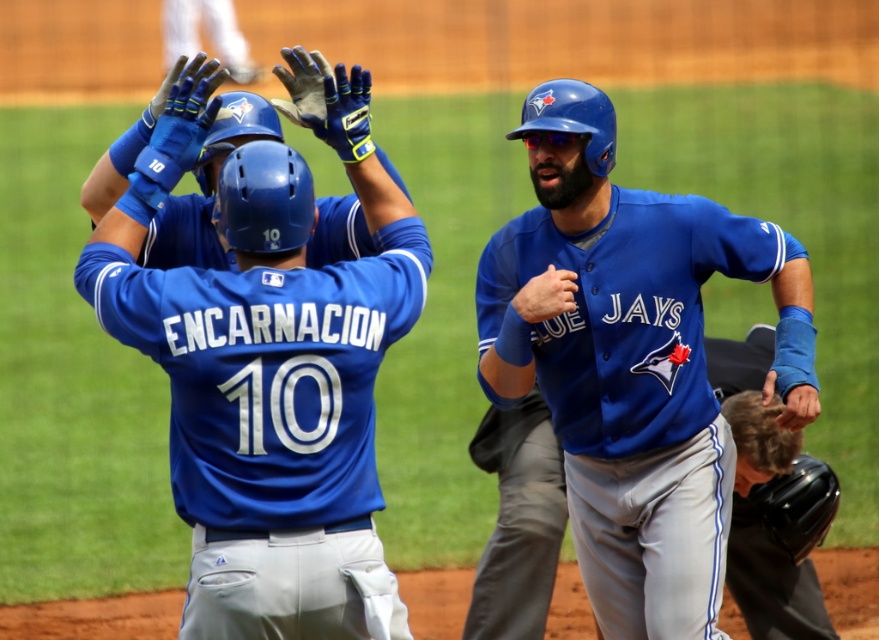
Question: Among these objects, which one is farthest from the camera?

Choices:
 (A) blue jersey at center
 (B) matte blue helmet at upper center

Answer: (A)

Question: Is the position of matte blue helmet at upper center less distant than that of blue jersey at center?

Choices:
 (A) no
 (B) yes

Answer: (B)

Question: Does matte blue helmet at upper center have a lesser width compared to blue jersey at center?

Choices:
 (A) no
 (B) yes

Answer: (B)

Question: Is the position of matte blue helmet at upper center less distant than that of blue jersey at center?

Choices:
 (A) no
 (B) yes

Answer: (B)